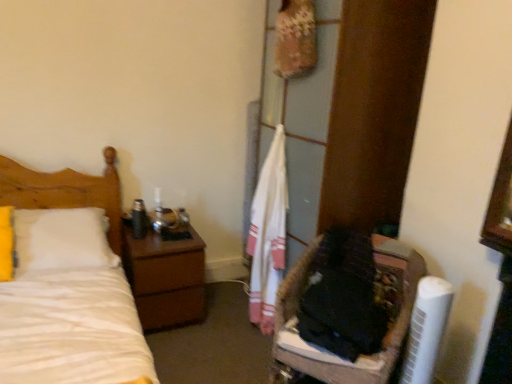
Question: From a real-world perspective, is white plastic air conditioner at lower right physically below white cotton towel at center?

Choices:
 (A) yes
 (B) no

Answer: (A)

Question: Is white plastic air conditioner at lower right oriented towards white cotton towel at center?

Choices:
 (A) no
 (B) yes

Answer: (A)

Question: From the image's perspective, would you say white plastic air conditioner at lower right is shown under white cotton towel at center?

Choices:
 (A) yes
 (B) no

Answer: (A)

Question: Can you confirm if white plastic air conditioner at lower right is bigger than white cotton towel at center?

Choices:
 (A) no
 (B) yes

Answer: (A)

Question: Is white plastic air conditioner at lower right in contact with white cotton towel at center?

Choices:
 (A) yes
 (B) no

Answer: (B)

Question: Considering the relative sizes of white plastic air conditioner at lower right and white cotton towel at center in the image provided, is white plastic air conditioner at lower right taller than white cotton towel at center?

Choices:
 (A) no
 (B) yes

Answer: (A)

Question: Can you confirm if fuzzy fabric basket at lower right is smaller than white cotton towel at center?

Choices:
 (A) no
 (B) yes

Answer: (A)

Question: Considering the relative sizes of fuzzy fabric basket at lower right and white cotton towel at center in the image provided, is fuzzy fabric basket at lower right thinner than white cotton towel at center?

Choices:
 (A) no
 (B) yes

Answer: (A)

Question: Is the depth of fuzzy fabric basket at lower right greater than that of white cotton towel at center?

Choices:
 (A) no
 (B) yes

Answer: (A)

Question: Considering the relative sizes of fuzzy fabric basket at lower right and white cotton towel at center in the image provided, is fuzzy fabric basket at lower right shorter than white cotton towel at center?

Choices:
 (A) yes
 (B) no

Answer: (A)

Question: Is the position of fuzzy fabric basket at lower right less distant than that of white cotton towel at center?

Choices:
 (A) yes
 (B) no

Answer: (A)

Question: From a real-world perspective, is fuzzy fabric basket at lower right on white cotton towel at center?

Choices:
 (A) no
 (B) yes

Answer: (A)

Question: Is brown wood nightstand at left looking in the opposite direction of white matte bed at left?

Choices:
 (A) no
 (B) yes

Answer: (A)